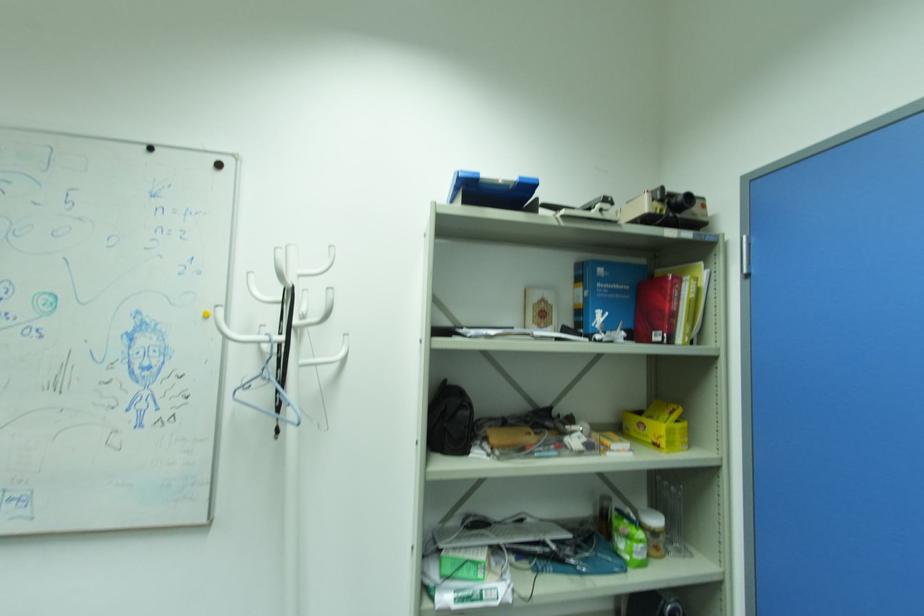
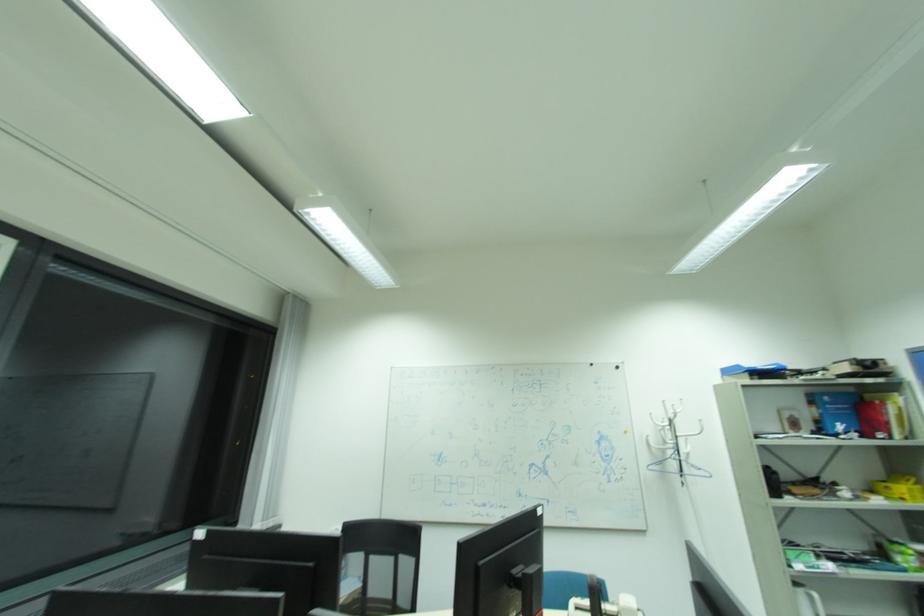
The images are taken continuously from a first-person perspective. In which direction are you moving?

The cameraman moved toward left, backward.